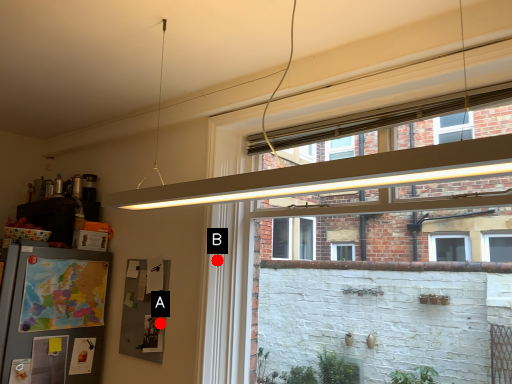
Question: Two points are circled on the image, labeled by A and B beside each circle. Which of the following is the farthest from the observer?

Choices:
 (A) A is further
 (B) B is further

Answer: (A)